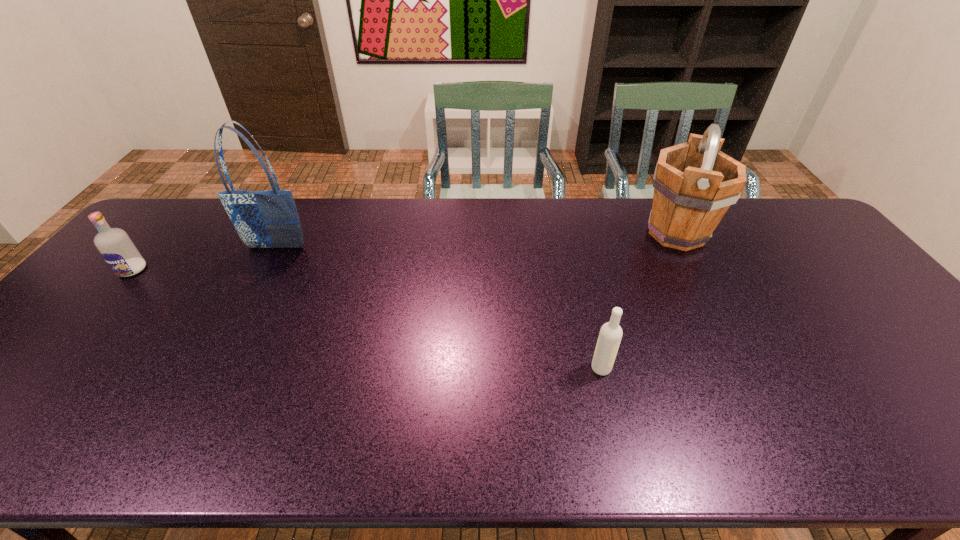
I want to click on empty location between the nearest object and the left vodka, so click(367, 319).

Image resolution: width=960 pixels, height=540 pixels. Identify the location of free space between the second object from left to right and the right vodka. (439, 308).

Locate an element on the screen. free space between the third object from right to left and the leftmost object is located at coordinates (204, 259).

Image resolution: width=960 pixels, height=540 pixels. Identify the location of vacant space that's between the third object from left to right and the rightmost object. (638, 301).

Where is `vacant point located between the second object from right to left and the third object from right to left`? Image resolution: width=960 pixels, height=540 pixels. vacant point located between the second object from right to left and the third object from right to left is located at coordinates (439, 308).

The image size is (960, 540). Find the location of `vacant area between the nearer vodka and the bucket`. vacant area between the nearer vodka and the bucket is located at coordinates (638, 301).

Identify the location of empty space that is in between the right vodka and the leftmost object. The height and width of the screenshot is (540, 960). (367, 319).

Image resolution: width=960 pixels, height=540 pixels. What are the coordinates of `free space between the rightmost object and the nearest object` in the screenshot? It's located at (638, 301).

Point out which object is positioned as the second nearest to the bucket. Please provide its 2D coordinates. Your answer should be formatted as a tuple, i.e. [(x, y)], where the tuple contains the x and y coordinates of a point satisfying the conditions above.

[(263, 219)]

Where is `object that can be found as the third closest to the nearer vodka`? The image size is (960, 540). object that can be found as the third closest to the nearer vodka is located at coordinates (115, 246).